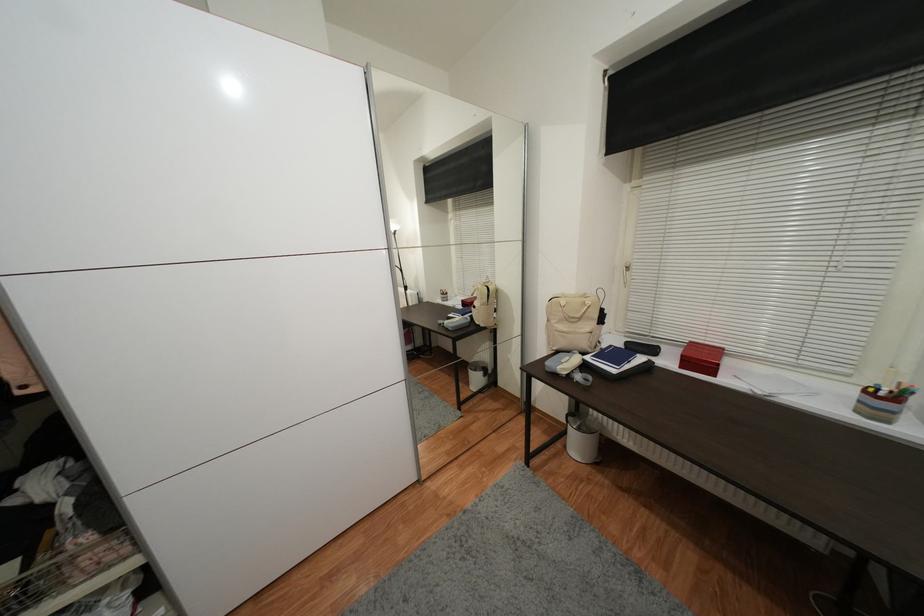
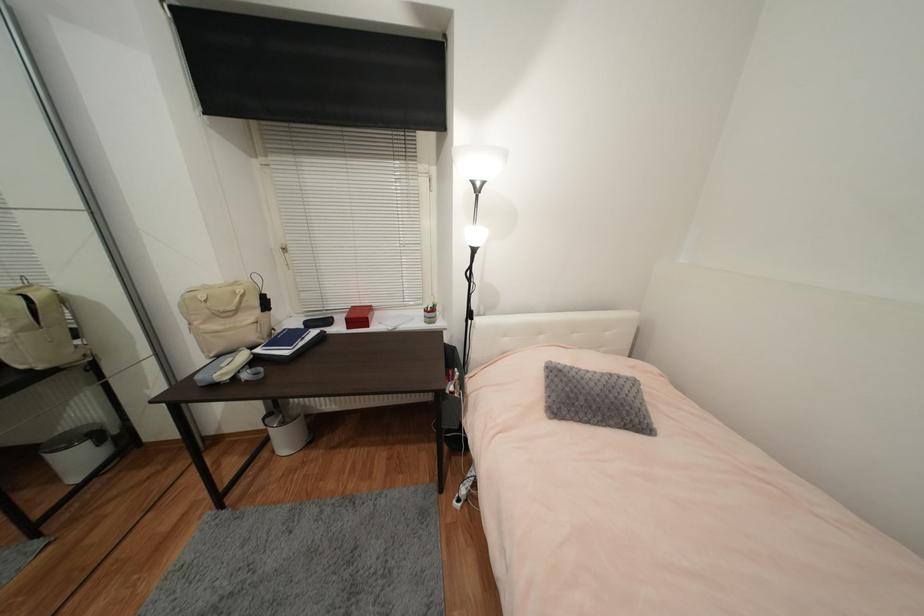
The point at (x=631, y=368) is marked in the first image. Where is the corresponding point in the second image?

(306, 344)